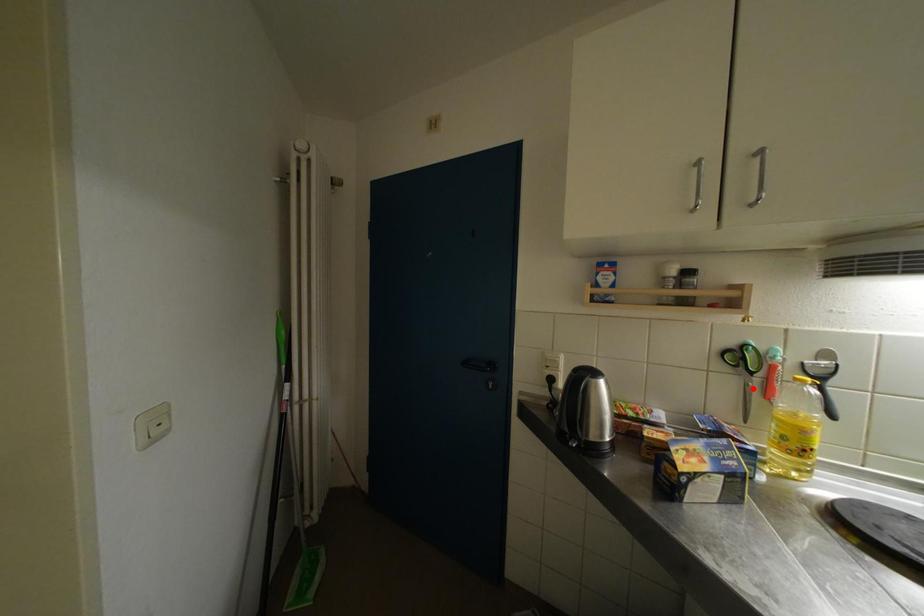
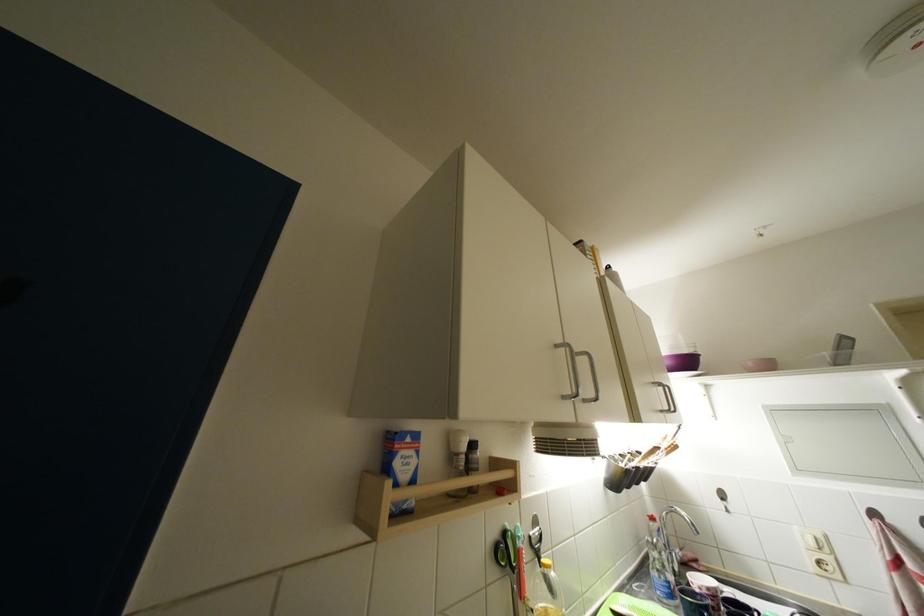
In the second image, find the point that corresponds to the highlighted location in the first image.

(518, 594)